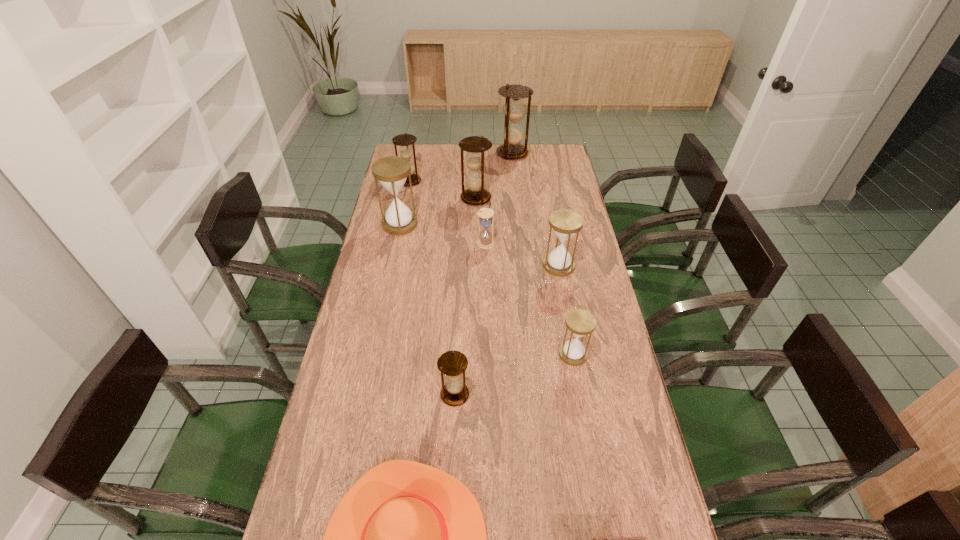
Where is `vacant region located 0.390m on the front of the nearest white hourglass`? This screenshot has width=960, height=540. vacant region located 0.390m on the front of the nearest white hourglass is located at coordinates (600, 505).

The image size is (960, 540). What are the coordinates of `free space located on the right of the nearest brown hourglass` in the screenshot? It's located at (561, 395).

The image size is (960, 540). Find the location of `object that is at the far edge`. object that is at the far edge is located at coordinates (515, 109).

In the image, there is a desktop. Where is `vacant space at the far edge`? vacant space at the far edge is located at coordinates (503, 164).

This screenshot has height=540, width=960. I want to click on vacant region at the left edge, so click(317, 470).

The width and height of the screenshot is (960, 540). I want to click on vacant area at the right edge, so click(x=612, y=403).

The width and height of the screenshot is (960, 540). In the image, there is a desktop. What are the coordinates of `vacant space at the far left corner` in the screenshot? It's located at (421, 159).

What are the coordinates of `free spot between the third farthest white hourglass and the third white hourglass from right to left` in the screenshot? It's located at (522, 254).

Locate an element on the screen. The width and height of the screenshot is (960, 540). free space between the biggest white hourglass and the third biggest brown hourglass is located at coordinates coord(405,203).

Locate an element on the screen. The width and height of the screenshot is (960, 540). free space between the seventh nearest hourglass and the leftmost white hourglass is located at coordinates pyautogui.click(x=405, y=203).